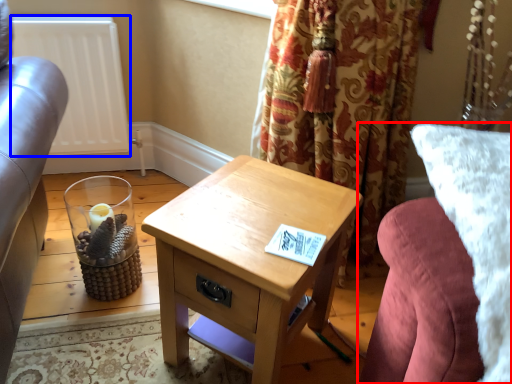
Question: Which object appears farthest to the camera in this image, studio couch (highlighted by a red box) or radiator (highlighted by a blue box)?

Choices:
 (A) studio couch
 (B) radiator

Answer: (B)